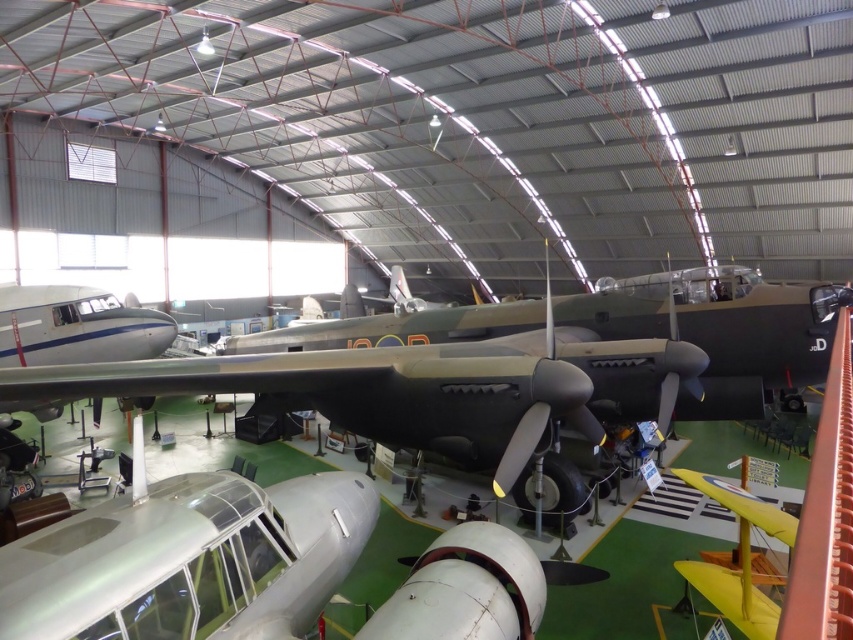
In the scene shown: You are standing at point [294,570] in the museum hangar and want to walk to the entrance located at point [288,384]. Is the entrance in front of or behind you?

The entrance at point [288,384] is behind you since it is positioned behind point [294,570] where you are standing.

What is located at the coordinates point (434, 387) in the image?

The camouflage paint airplane at center is located at point (434, 387).